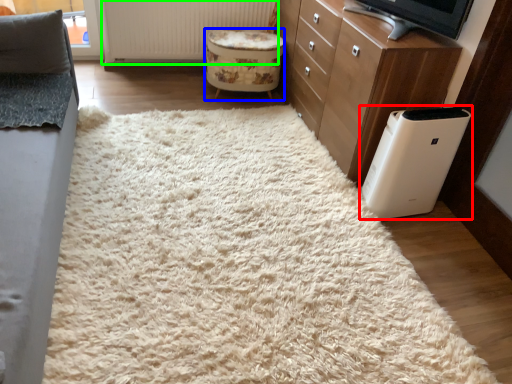
Question: Based on their relative distances, which object is farther from home appliance (highlighted by a red box)? Choose from stool (highlighted by a blue box) and radiator (highlighted by a green box).

Choices:
 (A) stool
 (B) radiator

Answer: (B)